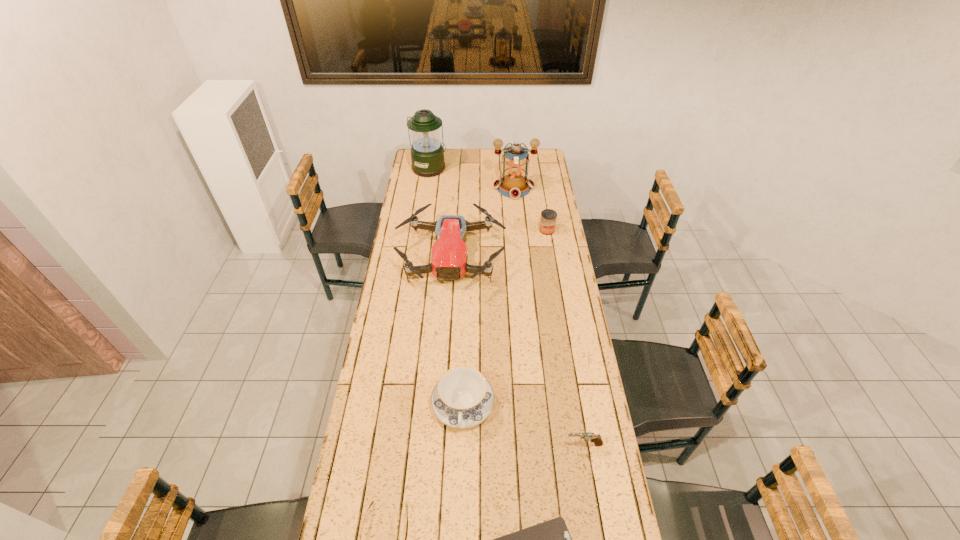
This screenshot has width=960, height=540. I want to click on pistol situated at the right edge, so click(597, 439).

Where is `object that is at the far left corner`? object that is at the far left corner is located at coordinates (427, 153).

The height and width of the screenshot is (540, 960). In the image, there is a desktop. Identify the location of vacant area at the far edge. click(483, 170).

This screenshot has height=540, width=960. In the image, there is a desktop. Find the location of `vacant space at the left edge`. vacant space at the left edge is located at coordinates (361, 469).

Locate an element on the screen. free space at the right edge of the desktop is located at coordinates (546, 247).

The height and width of the screenshot is (540, 960). Identify the location of free space at the far right corner. (541, 158).

Locate an element on the screen. This screenshot has height=540, width=960. vacant space that's between the right lantern and the third shortest object is located at coordinates (549, 316).

The image size is (960, 540). What are the coordinates of `vacant region between the left lantern and the right lantern` in the screenshot? It's located at (471, 178).

Locate an element on the screen. The width and height of the screenshot is (960, 540). free area in between the right lantern and the pistol is located at coordinates (549, 316).

Locate which object is the sixth closest to the third nearest object. Please provide its 2D coordinates. Your answer should be formatted as a tuple, i.e. [(x, y)], where the tuple contains the x and y coordinates of a point satisfying the conditions above.

[(514, 184)]